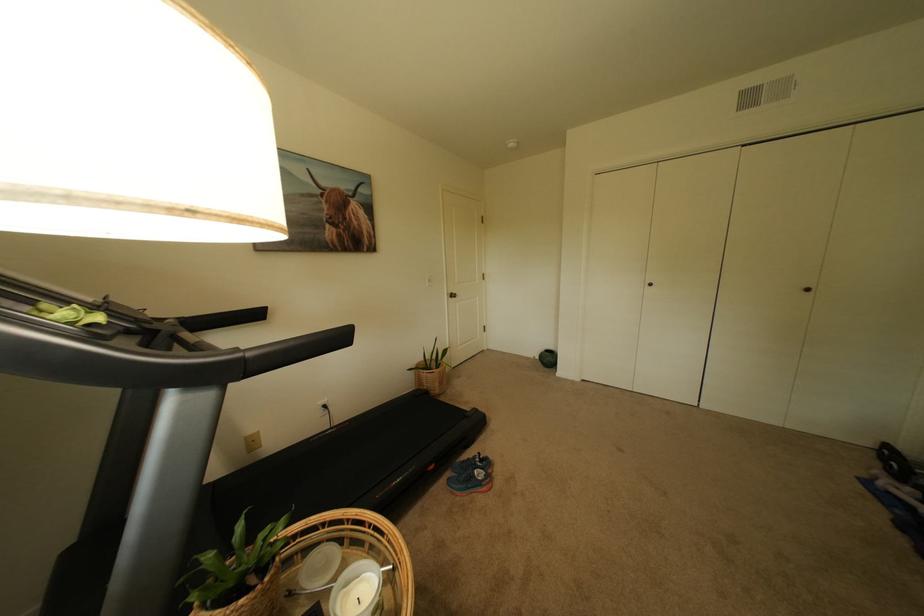
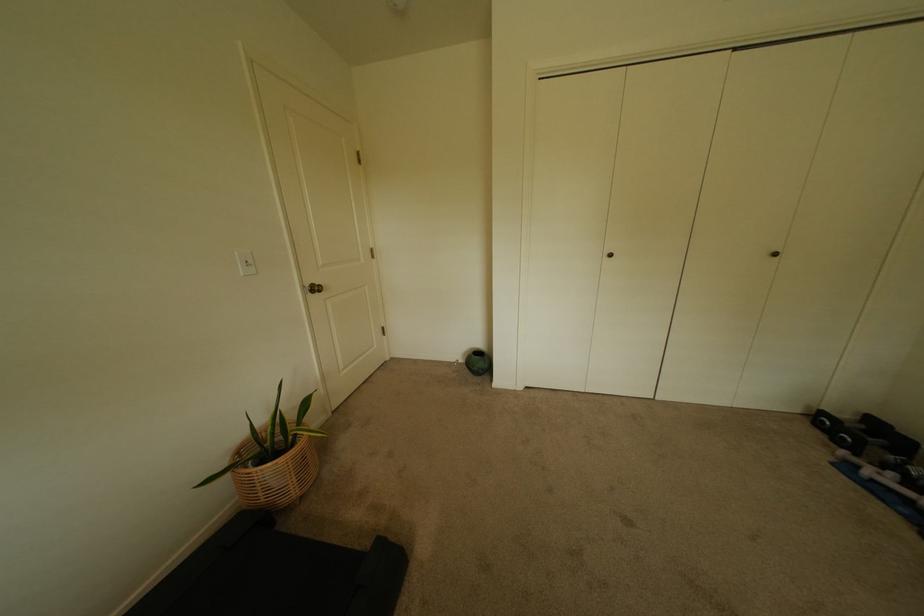
The point at (446, 385) is marked in the first image. Where is the corresponding point in the second image?

(302, 480)